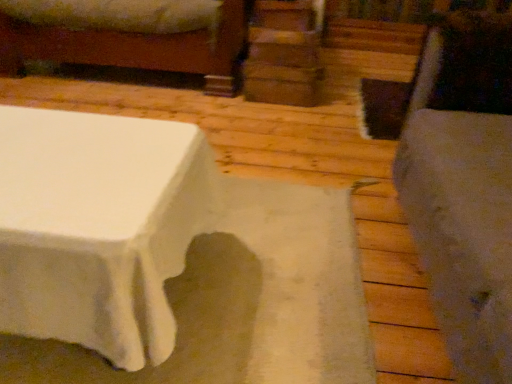
Question: Can we say fuzzy gray swivel chair at right lies outside wooden bed frame at upper left?

Choices:
 (A) yes
 (B) no

Answer: (A)

Question: From the image's perspective, is fuzzy gray swivel chair at right on top of wooden bed frame at upper left?

Choices:
 (A) yes
 (B) no

Answer: (B)

Question: Considering the relative sizes of fuzzy gray swivel chair at right and wooden bed frame at upper left in the image provided, is fuzzy gray swivel chair at right wider than wooden bed frame at upper left?

Choices:
 (A) yes
 (B) no

Answer: (B)

Question: Considering the relative sizes of fuzzy gray swivel chair at right and wooden bed frame at upper left in the image provided, is fuzzy gray swivel chair at right taller than wooden bed frame at upper left?

Choices:
 (A) no
 (B) yes

Answer: (B)

Question: From a real-world perspective, is fuzzy gray swivel chair at right positioned over wooden bed frame at upper left based on gravity?

Choices:
 (A) no
 (B) yes

Answer: (B)

Question: Does fuzzy gray swivel chair at right have a larger size compared to wooden bed frame at upper left?

Choices:
 (A) yes
 (B) no

Answer: (B)

Question: Is wooden bed frame at upper left touching fuzzy gray swivel chair at right?

Choices:
 (A) yes
 (B) no

Answer: (B)

Question: Is wooden bed frame at upper left aimed at fuzzy gray swivel chair at right?

Choices:
 (A) yes
 (B) no

Answer: (A)

Question: Is wooden bed frame at upper left shorter than fuzzy gray swivel chair at right?

Choices:
 (A) yes
 (B) no

Answer: (A)

Question: From the image's perspective, is wooden bed frame at upper left under fuzzy gray swivel chair at right?

Choices:
 (A) no
 (B) yes

Answer: (A)

Question: From a real-world perspective, is wooden bed frame at upper left on fuzzy gray swivel chair at right?

Choices:
 (A) yes
 (B) no

Answer: (B)

Question: Is wooden bed frame at upper left oriented away from fuzzy gray swivel chair at right?

Choices:
 (A) yes
 (B) no

Answer: (B)

Question: Considering the relative positions of wooden bed frame at upper left and fuzzy gray swivel chair at right in the image provided, is wooden bed frame at upper left to the left or to the right of fuzzy gray swivel chair at right?

Choices:
 (A) right
 (B) left

Answer: (B)